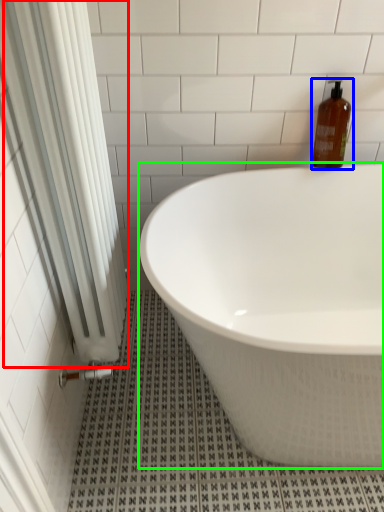
Question: Based on their relative distances, which object is nearer to shower curtain (highlighted by a red box)? Choose from bottle (highlighted by a blue box) and bathtub (highlighted by a green box).

Choices:
 (A) bottle
 (B) bathtub

Answer: (B)